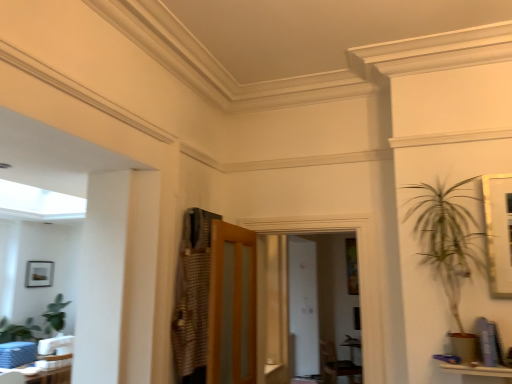
Question: Is checkered fabric armoire at center far from wooden frosted glass door at center?

Choices:
 (A) no
 (B) yes

Answer: (A)

Question: Is checkered fabric armoire at center facing towards wooden frosted glass door at center?

Choices:
 (A) no
 (B) yes

Answer: (A)

Question: Can you confirm if checkered fabric armoire at center is smaller than wooden frosted glass door at center?

Choices:
 (A) yes
 (B) no

Answer: (A)

Question: From a real-world perspective, is checkered fabric armoire at center below wooden frosted glass door at center?

Choices:
 (A) no
 (B) yes

Answer: (A)

Question: Is checkered fabric armoire at center positioned beyond the bounds of wooden frosted glass door at center?

Choices:
 (A) yes
 (B) no

Answer: (A)

Question: Is wooden frosted glass door at center at the back of checkered fabric armoire at center?

Choices:
 (A) yes
 (B) no

Answer: (B)

Question: Is dark brown leather armchair at center at the back of wooden frosted glass door at center?

Choices:
 (A) no
 (B) yes

Answer: (A)

Question: Is wooden frosted glass door at center facing towards dark brown leather armchair at center?

Choices:
 (A) yes
 (B) no

Answer: (B)

Question: Can you confirm if wooden frosted glass door at center is wider than dark brown leather armchair at center?

Choices:
 (A) yes
 (B) no

Answer: (B)

Question: From a real-world perspective, is wooden frosted glass door at center on top of dark brown leather armchair at center?

Choices:
 (A) yes
 (B) no

Answer: (A)

Question: From a real-world perspective, is wooden frosted glass door at center positioned under dark brown leather armchair at center based on gravity?

Choices:
 (A) yes
 (B) no

Answer: (B)

Question: Is dark brown leather armchair at center a part of wooden frosted glass door at center?

Choices:
 (A) yes
 (B) no

Answer: (B)

Question: Is matte black picture frame at left shorter than checkered fabric armoire at center?

Choices:
 (A) yes
 (B) no

Answer: (A)